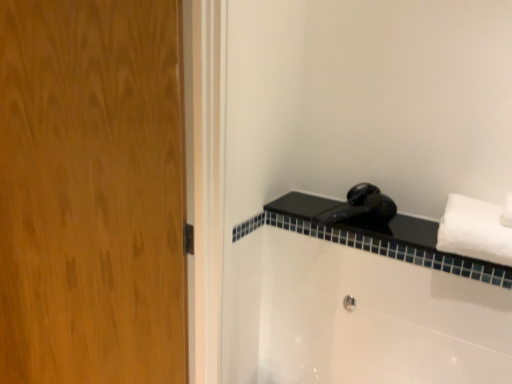
Question: Considering the positions of white fluffy towel at right and black matte faucet at upper right in the image, is white fluffy towel at right wider or thinner than black matte faucet at upper right?

Choices:
 (A) thin
 (B) wide

Answer: (A)

Question: Choose the correct answer: Is white fluffy towel at right inside black matte faucet at upper right or outside it?

Choices:
 (A) inside
 (B) outside

Answer: (B)

Question: Which object is the closest to the black matte faucet at upper right?

Choices:
 (A) white fluffy towel at right
 (B) wooden door at left
 (C) metallic silver showerhead at lower center
 (D) black glossy hairdryer at upper right

Answer: (D)

Question: Which is nearer to the wooden door at left?

Choices:
 (A) black matte faucet at upper right
 (B) metallic silver showerhead at lower center
 (C) white fluffy towel at right
 (D) black glossy hairdryer at upper right

Answer: (D)